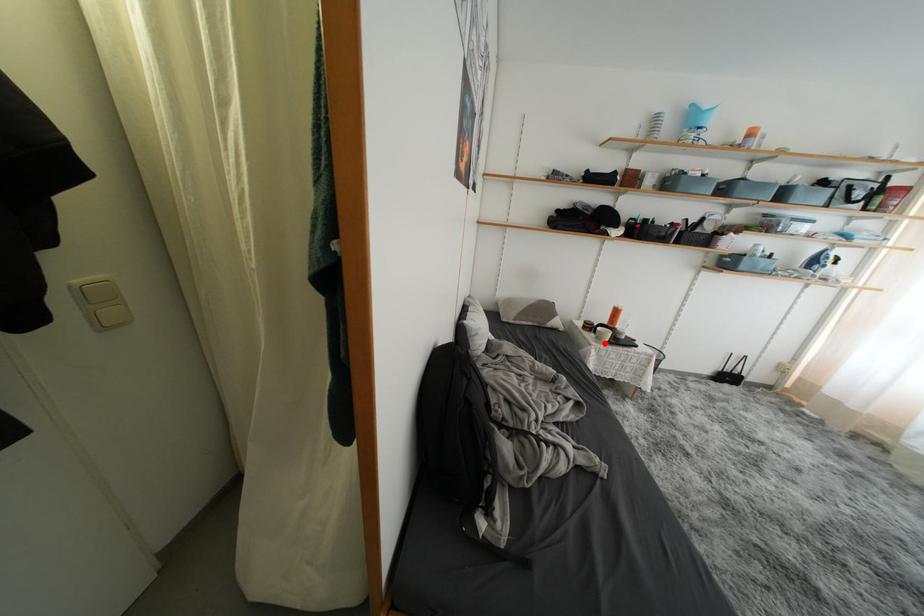
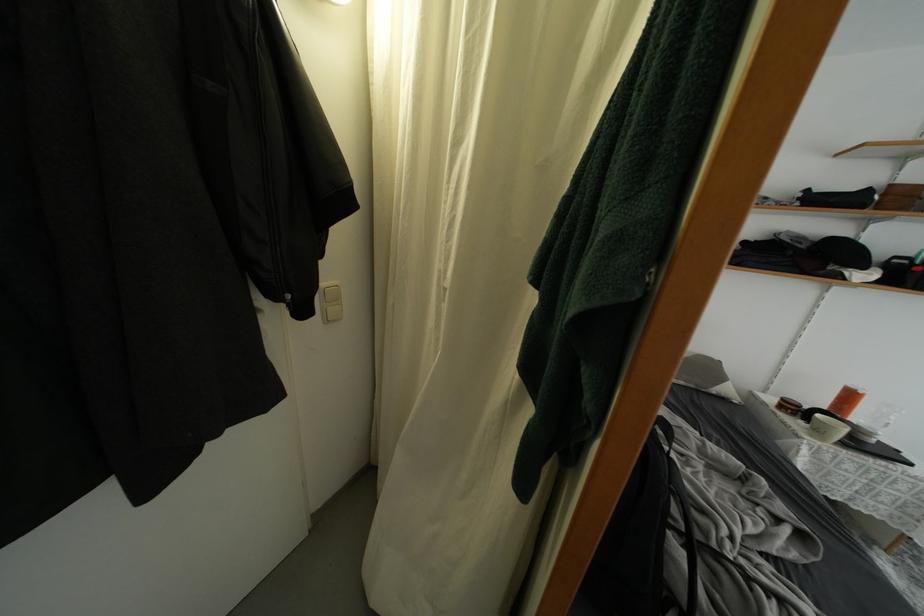
Find the pixel in the second image that matches the highlighted location in the first image.

(823, 437)